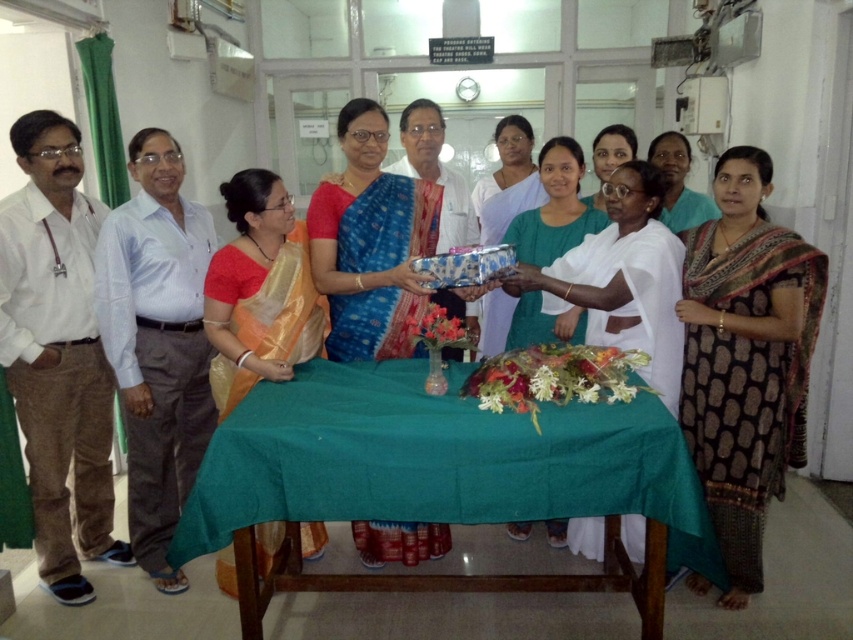
You are organizing a photo shoot and need to arrange two outfits based on their sizes. You have a white cotton shirt at left and a blue silk saree at center. Which outfit requires more space to display properly?

The blue silk saree at center requires more space to display properly because it has a greater width than the white cotton shirt at left.